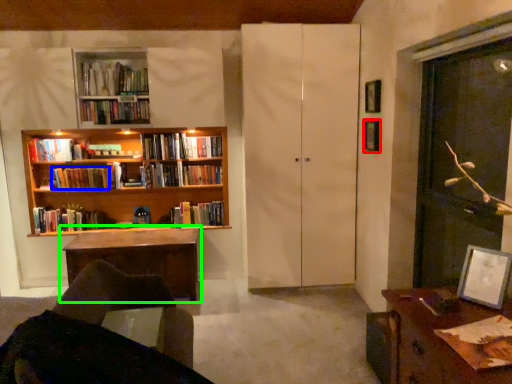
Question: Which object is the closest to the picture frame (highlighted by a red box)? Choose among these: book (highlighted by a blue box) or table (highlighted by a green box).

Choices:
 (A) book
 (B) table

Answer: (B)